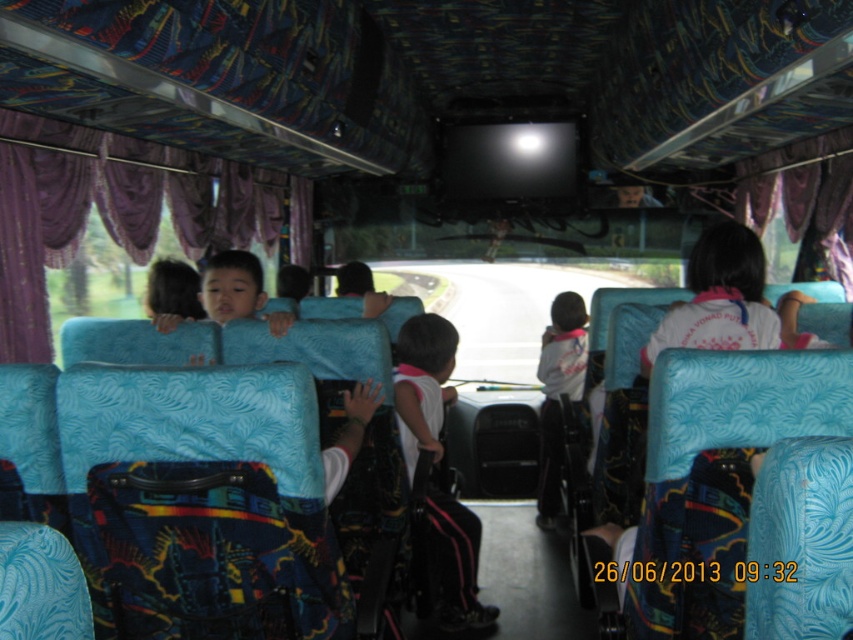
Question: Is purple velvet curtain at left behind white cotton shirt at center?

Choices:
 (A) no
 (B) yes

Answer: (A)

Question: Is white matte shirt at center positioned before white cotton shirt at center?

Choices:
 (A) yes
 (B) no

Answer: (A)

Question: Can you confirm if white matte shirt at center is smaller than white cotton shirt at center?

Choices:
 (A) no
 (B) yes

Answer: (A)

Question: Which point appears closest to the camera in this image?

Choices:
 (A) (550, 324)
 (B) (463, 602)
 (C) (136, 248)

Answer: (B)

Question: Which point is closer to the camera?

Choices:
 (A) purple velvet curtain at left
 (B) white matte shirt at center
 (C) white cotton shirt at center

Answer: (A)

Question: Among these points, which one is farthest from the camera?

Choices:
 (A) (16, 218)
 (B) (548, 340)
 (C) (436, 518)

Answer: (B)